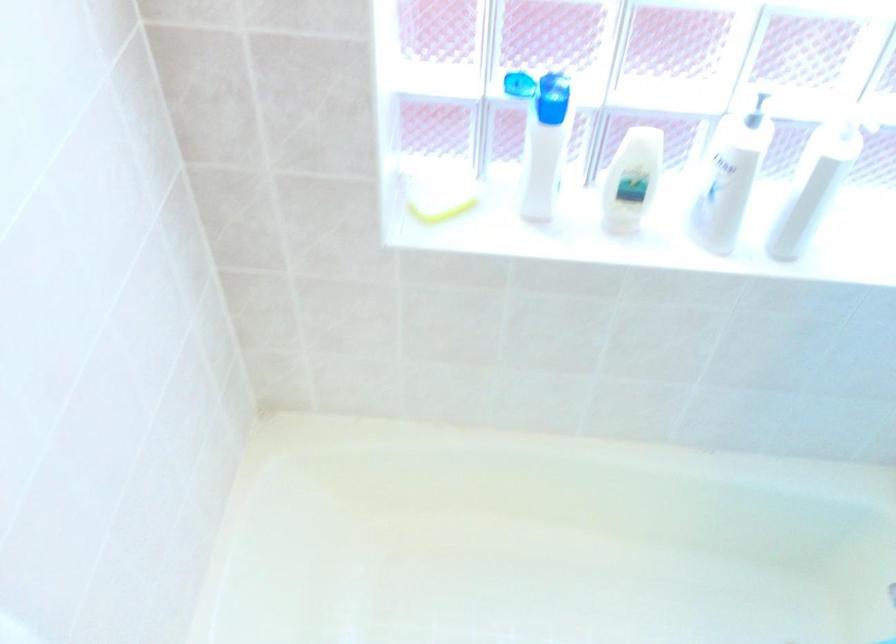
The location [438,196] corresponds to which object?

It corresponds to the yellow sponge in the image.